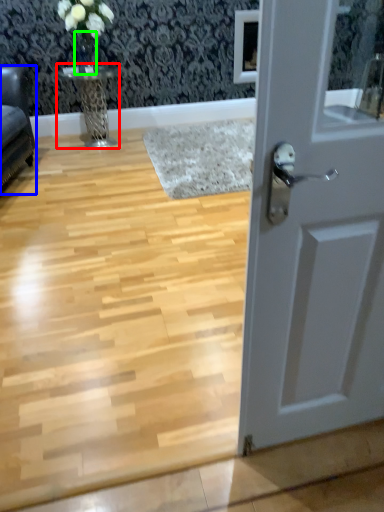
Question: Based on their relative distances, which object is nearer to table (highlighted by a red box)? Choose from furniture (highlighted by a blue box) and glass vase (highlighted by a green box).

Choices:
 (A) furniture
 (B) glass vase

Answer: (B)